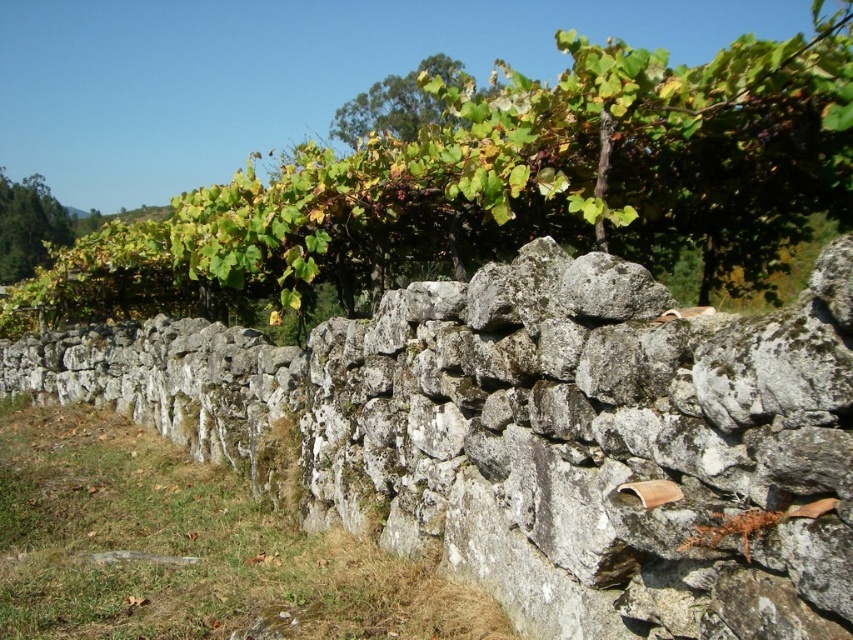
The width and height of the screenshot is (853, 640). I want to click on gray rough stone wall at center, so coord(537,436).

Consider the image. Which is above, gray rough stone wall at center or green leafy vine at upper center?

green leafy vine at upper center is higher up.

Between point (677, 429) and point (795, 56), which one is positioned in front?

Positioned in front is point (677, 429).

Locate an element on the screen. The image size is (853, 640). gray rough stone wall at center is located at coordinates (537, 436).